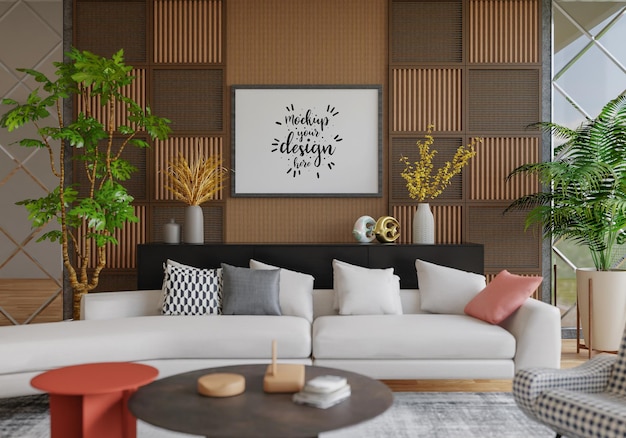
At what (x,y) coordinates should I click in order to perform the action: click on rug. Please return your answer as a coordinate pair (x, y). The height and width of the screenshot is (438, 626). Looking at the image, I should click on (451, 417).